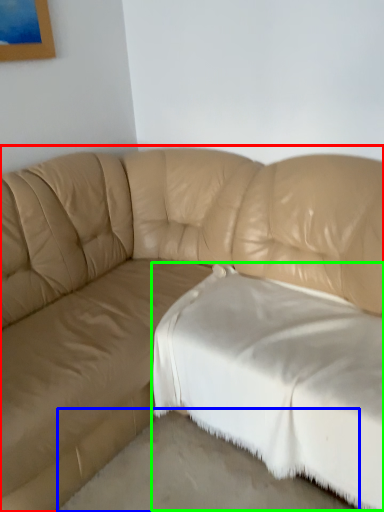
Question: Considering the real-world distances, which object is closest to studio couch (highlighted by a red box)? concrete (highlighted by a blue box) or sheet (highlighted by a green box).

Choices:
 (A) concrete
 (B) sheet

Answer: (B)